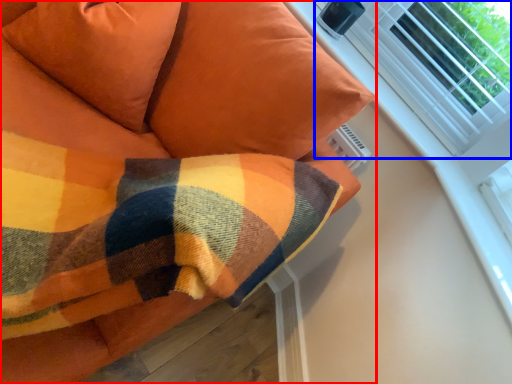
Question: Among these objects, which one is nearest to the camera, furniture (highlighted by a red box) or bay window (highlighted by a blue box)?

Choices:
 (A) furniture
 (B) bay window

Answer: (A)